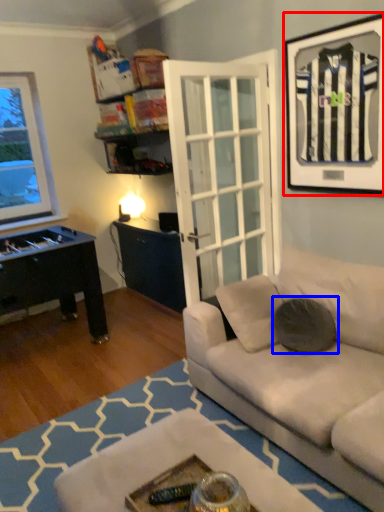
Question: Which object is further to the camera taking this photo, picture frame (highlighted by a red box) or pillow (highlighted by a blue box)?

Choices:
 (A) picture frame
 (B) pillow

Answer: (B)